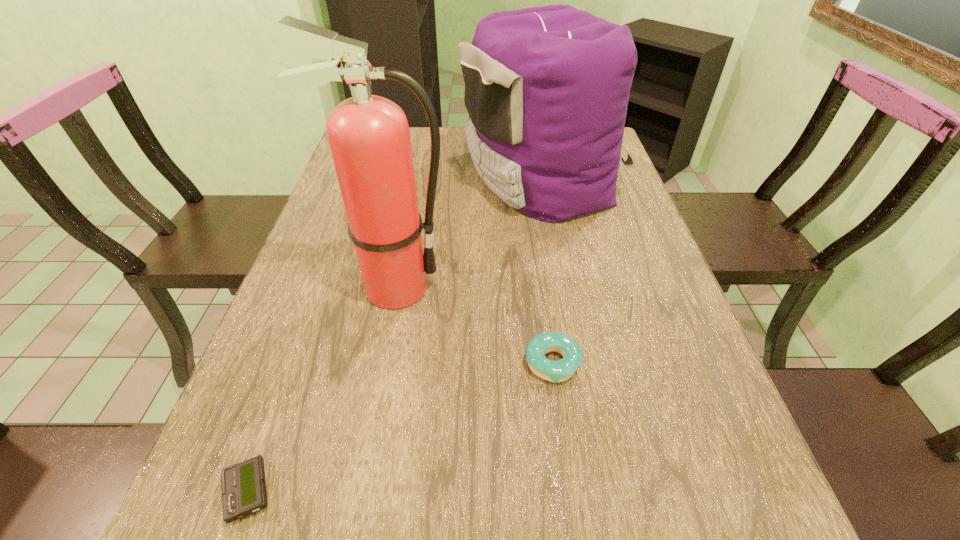
At what (x,y) coordinates should I click in order to perform the action: click on object that is at the far right corner. Please return your answer as a coordinate pair (x, y). Looking at the image, I should click on (547, 88).

Where is `free space at the far edge of the desktop`? free space at the far edge of the desktop is located at coordinates (447, 130).

This screenshot has height=540, width=960. What are the coordinates of `free space at the near edge` in the screenshot? It's located at (382, 539).

This screenshot has width=960, height=540. In order to click on free space at the left edge of the desktop in this screenshot , I will do `click(331, 230)`.

Identify the location of free space at the right edge. (680, 355).

Where is `vacant space at the near left corner of the desktop`? This screenshot has height=540, width=960. vacant space at the near left corner of the desktop is located at coordinates (229, 532).

Identify the location of empty space that is in between the shortest object and the second shortest object. Image resolution: width=960 pixels, height=540 pixels. (400, 427).

The image size is (960, 540). Find the location of `free point between the second shortest object and the second farthest object`. free point between the second shortest object and the second farthest object is located at coordinates (473, 325).

This screenshot has width=960, height=540. In order to click on vacant region between the tallest object and the second shortest object in this screenshot , I will do `click(473, 325)`.

Locate an element on the screen. vacant space in between the nearest object and the second shortest object is located at coordinates (400, 427).